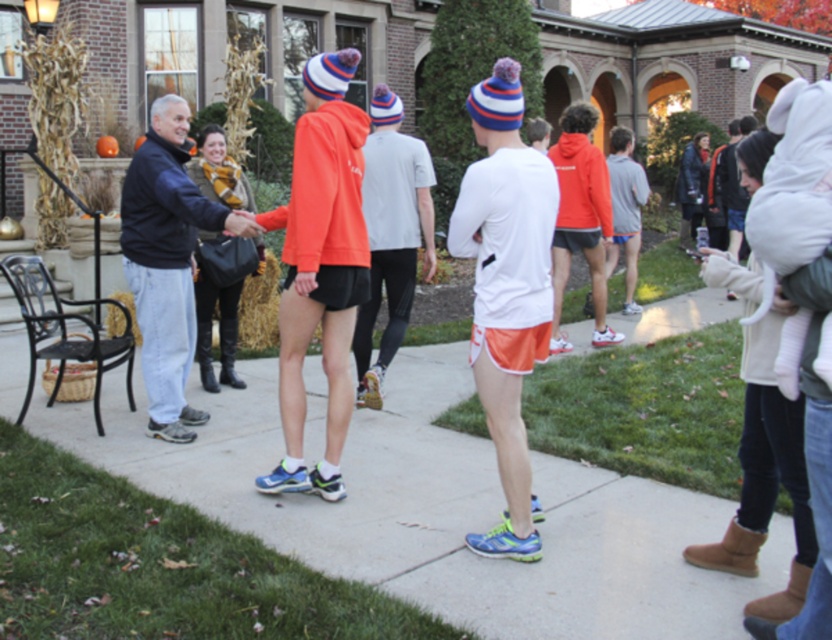
Question: Among these objects, which one is nearest to the camera?

Choices:
 (A) white matte long-sleeve shirt at center
 (B) white matte t-shirt at center
 (C) orange fleece sweatshirt at center

Answer: (A)

Question: From the image, what is the correct spatial relationship of concrete pavement at center in relation to white matte t-shirt at center?

Choices:
 (A) below
 (B) above

Answer: (A)

Question: Can you confirm if concrete pavement at center is positioned below white matte t-shirt at center?

Choices:
 (A) yes
 (B) no

Answer: (A)

Question: Which object is positioned farthest from the white matte t-shirt at center?

Choices:
 (A) orange fleece sweatshirt at center
 (B) concrete pavement at center

Answer: (B)

Question: Which object is the closest to the concrete pavement at center?

Choices:
 (A) white matte long-sleeve shirt at center
 (B) dark blue jacket at left
 (C) white matte t-shirt at center
 (D) orange fleece sweatshirt at center

Answer: (A)

Question: In this image, where is concrete pavement at center located relative to dark blue jacket at left?

Choices:
 (A) above
 (B) below

Answer: (B)